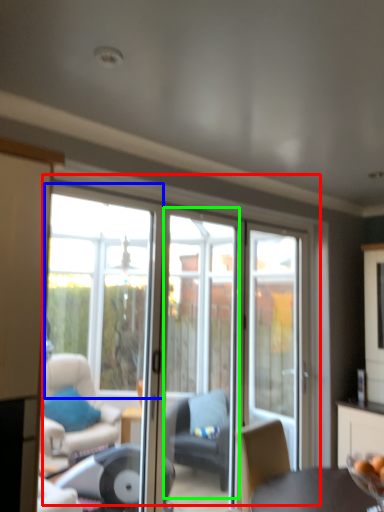
Question: Which object is positioned farthest from door (highlighted by a red box)? Select from window (highlighted by a blue box) and screen door (highlighted by a green box).

Choices:
 (A) window
 (B) screen door

Answer: (A)